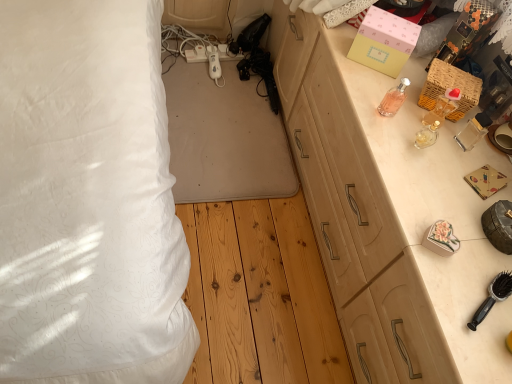
In order to click on space that is in front of translucent glass perfume at right, the 2th perfume viewed from the right in this screenshot , I will do `click(414, 182)`.